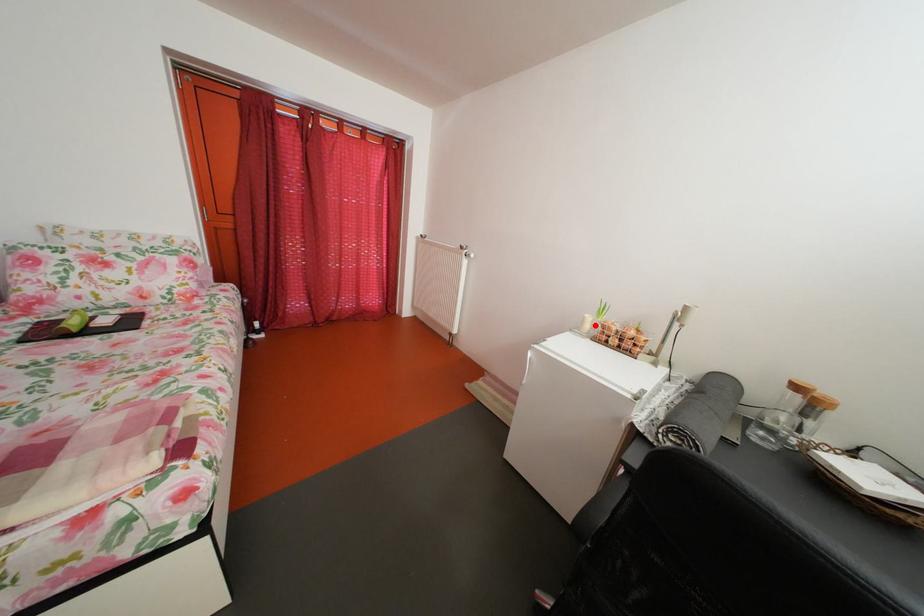
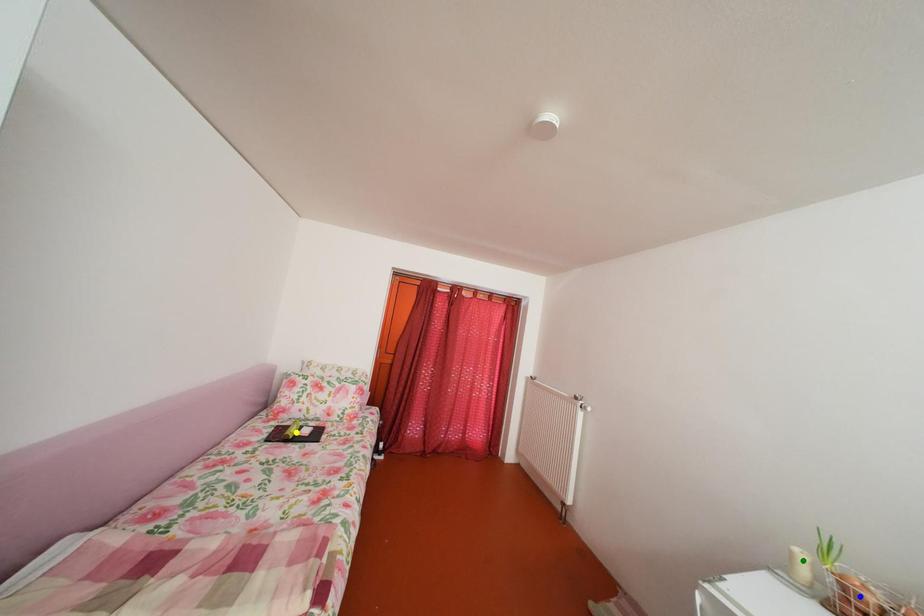
Question: I am providing you with two images of the same scene from different viewpoints. A red point is marked on the first image. You are given multiple points on the second image. Can you choose the point in image 2 that corresponds to the point in image 1?

Choices:
 (A) blue point
 (B) green point
 (C) yellow point

Answer: (B)